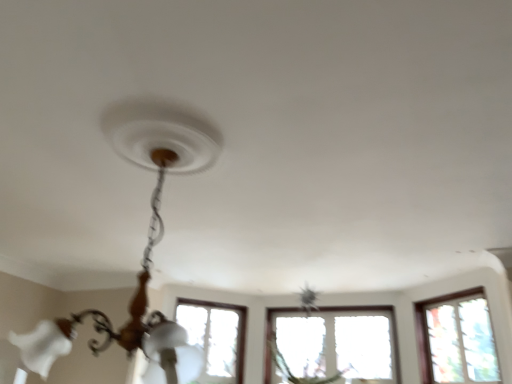
Question: From the image's perspective, is matte white chandelier at center positioned above or below clear glass window at right?

Choices:
 (A) below
 (B) above

Answer: (B)

Question: Is matte white chandelier at center wider or thinner than clear glass window at right?

Choices:
 (A) thin
 (B) wide

Answer: (B)

Question: From a real-world perspective, is matte white chandelier at center above or below clear glass window at right?

Choices:
 (A) below
 (B) above

Answer: (A)

Question: Considering their positions, is clear glass window at right located in front of or behind matte white chandelier at center?

Choices:
 (A) front
 (B) behind

Answer: (B)

Question: Considering the relative positions of clear glass window at right and matte white chandelier at center in the image provided, is clear glass window at right to the left or to the right of matte white chandelier at center?

Choices:
 (A) right
 (B) left

Answer: (A)

Question: Is clear glass window at right taller or shorter than matte white chandelier at center?

Choices:
 (A) tall
 (B) short

Answer: (B)

Question: Is point (422, 339) closer or farther from the camera than point (196, 140)?

Choices:
 (A) closer
 (B) farther

Answer: (B)